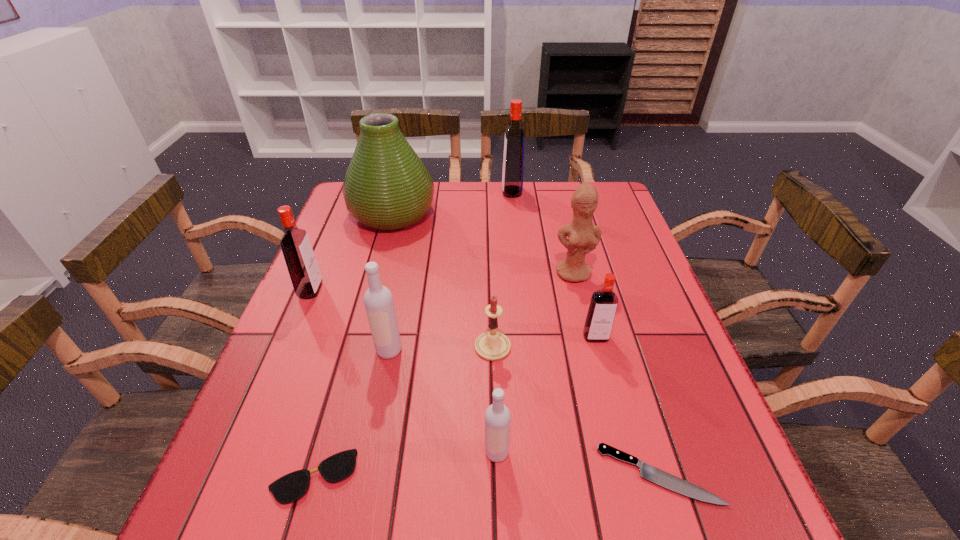
You are a GUI agent. You are given a task and a screenshot of the screen. Output one action in this format:
    pyautogui.click(x=<x>, y=<y>)
    Task: Click on the object that is positioned at the near right corner
    
    Given the screenshot: What is the action you would take?
    (x=648, y=472)

This screenshot has height=540, width=960. In the image, there is a desktop. In order to click on vacant space at the far edge in this screenshot , I will do `click(522, 211)`.

Image resolution: width=960 pixels, height=540 pixels. In the image, there is a desktop. In order to click on vacant space at the near edge in this screenshot , I will do pos(529,532).

Locate an element on the screen. This screenshot has height=540, width=960. free location at the left edge of the desktop is located at coordinates (254, 416).

Identify the location of vacant space at the right edge of the desktop. The height and width of the screenshot is (540, 960). pyautogui.click(x=654, y=343).

The height and width of the screenshot is (540, 960). Find the location of `free space at the far right corner`. free space at the far right corner is located at coordinates (571, 194).

Identify the location of vacant position at the near right corner of the desktop. The width and height of the screenshot is (960, 540). (731, 531).

You are a GUI agent. You are given a task and a screenshot of the screen. Output one action in this format:
    pyautogui.click(x=<x>, y=<y>)
    Task: Click on the vacant area between the smaller white vodka and the leftmost red vodka
    The height and width of the screenshot is (540, 960).
    Given the screenshot: What is the action you would take?
    pyautogui.click(x=403, y=371)

Identify the location of free point between the spectacles and the second nearest red vodka. (312, 383).

Locate an element on the screen. The width and height of the screenshot is (960, 540). empty space that is in between the spectacles and the third vodka from left to right is located at coordinates (405, 464).